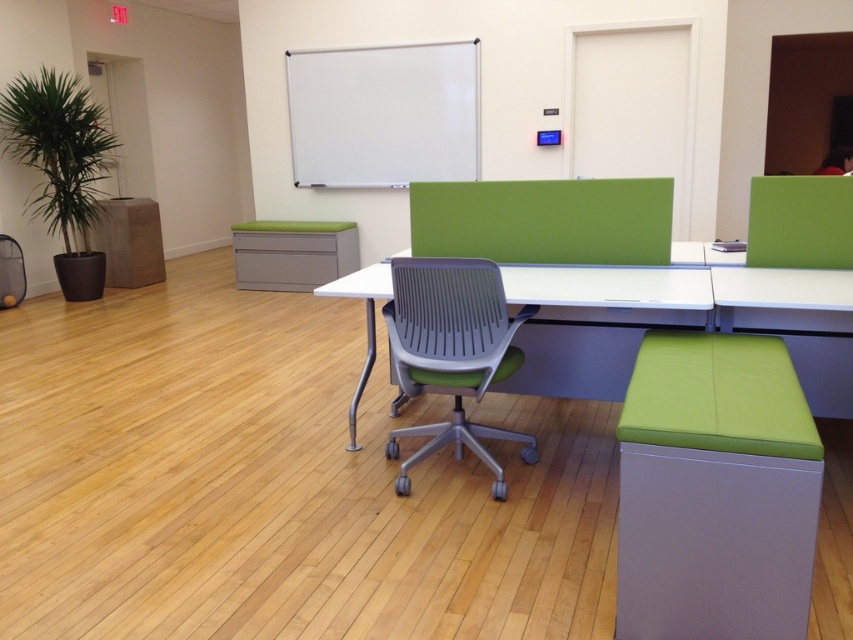
You are organizing a small meeting in the office. You need to place a laptop on the white plastic table at center. However, there is a green fabric stool at lower right in the way. Can you move the stool to the left to make space?

The green fabric stool at lower right is to the right of the white plastic table at center. Moving it to the left would place it closer to the table, but since it is already positioned to the right, moving it left would clear space on the right side of the table. However, the exact positioning isn

You are standing at the entrance of the office and want to sit down in the gray plastic swivel chair at center. Which direction should you walk to reach it?

Walk towards the center of the office to reach the gray plastic swivel chair at center.